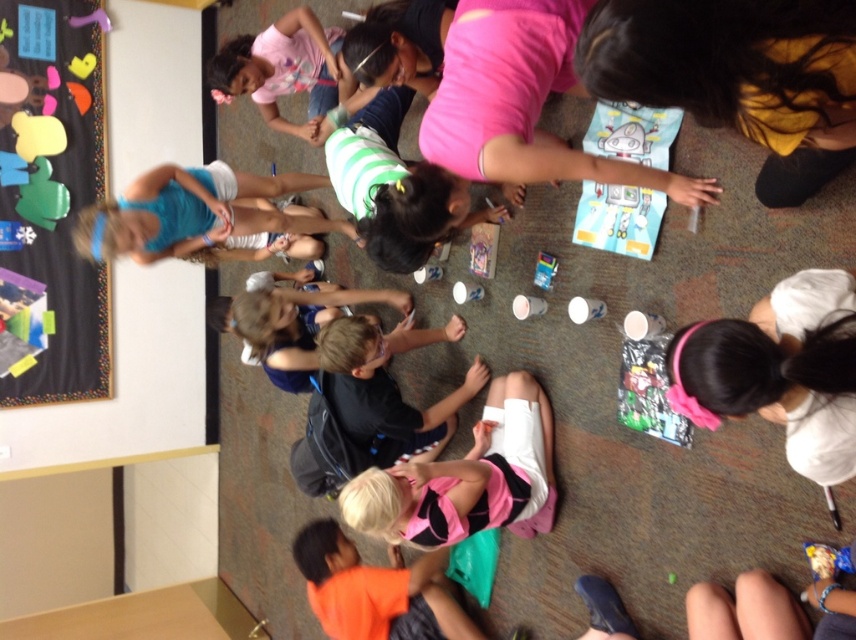
Does yellow fabric shirt at lower right appear on the right side of pink matte shirt at center?

Yes, yellow fabric shirt at lower right is to the right of pink matte shirt at center.

Who is more forward, [629,76] or [541,60]?

Point [629,76] is more forward.

At what (x,y) coordinates should I click in order to perform the action: click on yellow fabric shirt at lower right. Please return your answer as a coordinate pair (x, y). Looking at the image, I should click on (736, 76).

Measure the distance between point (x=72, y=317) and camera.

They are 4.05 meters apart.

In the scene shown: Is matte black paper at upper left wider than yellow fabric shirt at lower right?

No.

Locate an element on the screen. matte black paper at upper left is located at coordinates (51, 202).

Find the location of a particular element. Image resolution: width=856 pixels, height=640 pixels. matte black paper at upper left is located at coordinates (51, 202).

Who is more distant from viewer, (48, 275) or (325, 525)?

Point (48, 275)

Can you confirm if matte black paper at upper left is positioned above orange fabric at lower center?

Yes, matte black paper at upper left is above orange fabric at lower center.

The height and width of the screenshot is (640, 856). I want to click on matte black paper at upper left, so click(x=51, y=202).